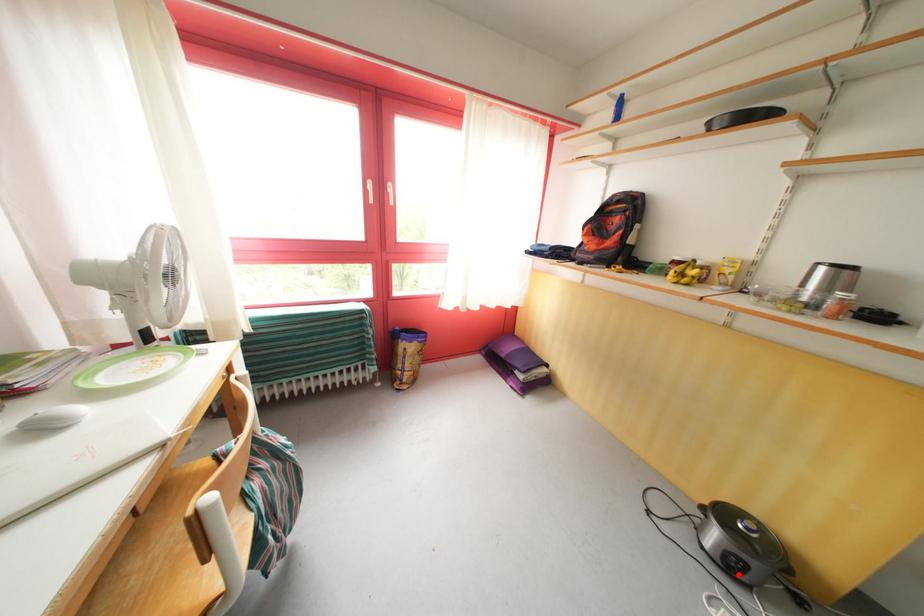
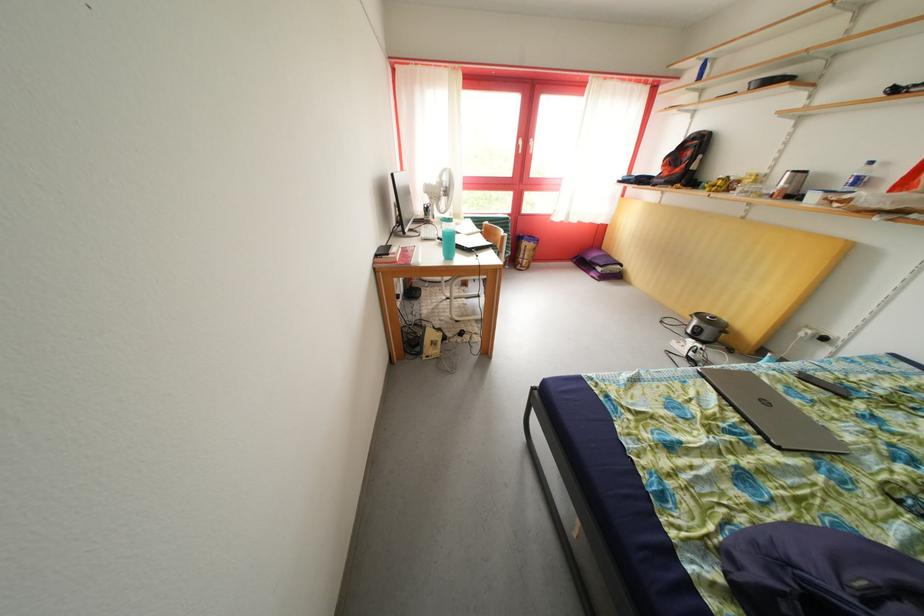
Question: I am providing you with two images of the same scene from different viewpoints. A red point is shown in image1. For the corresponding object point in image2, is it positioned nearer or farther from the camera?

Choices:
 (A) Nearer
 (B) Farther

Answer: (A)